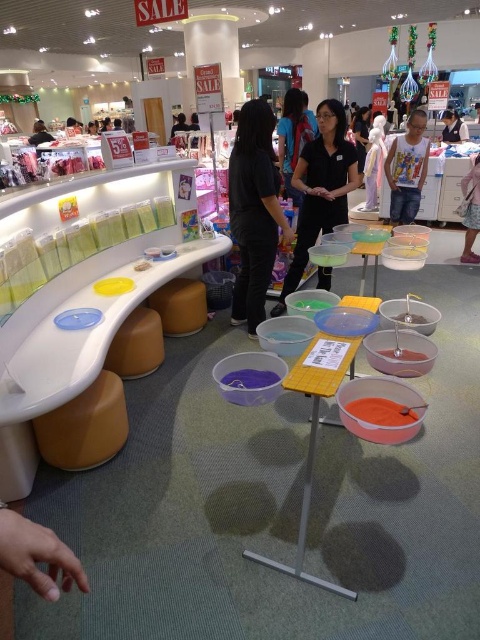
You are a customer in the store and need to sit down. You see the matte orange stool at lower left and the matte black shirt at upper right. Which object is shorter and more suitable for sitting?

The matte orange stool at lower left is shorter than the matte black shirt at upper right, making it the suitable option for sitting.